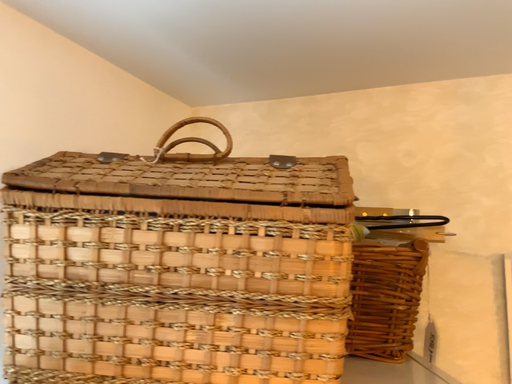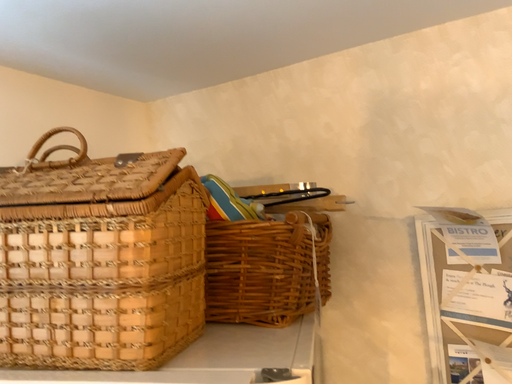
Question: Which way did the camera rotate in the video?

Choices:
 (A) rotated left
 (B) rotated right

Answer: (A)